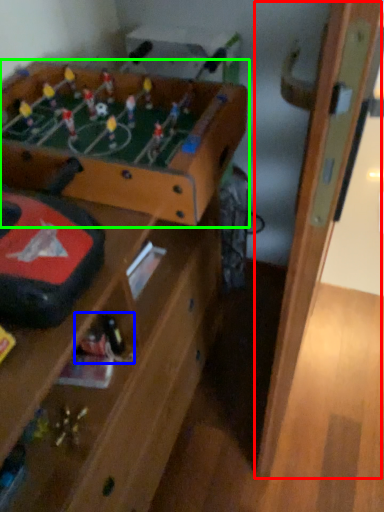
Question: Which object is the farthest from door (highlighted by a red box)? Choose among these: toy (highlighted by a blue box) or table (highlighted by a green box).

Choices:
 (A) toy
 (B) table

Answer: (A)